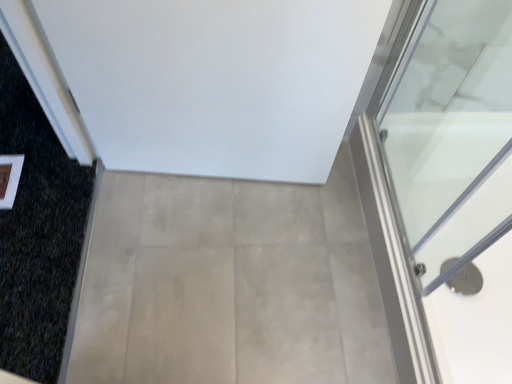
Locate an element on the screen. The image size is (512, 384). transparent glass door at right is located at coordinates (449, 132).

What do you see at coordinates (449, 132) in the screenshot? I see `transparent glass door at right` at bounding box center [449, 132].

Where is `transparent glass door at right`? This screenshot has width=512, height=384. transparent glass door at right is located at coordinates (449, 132).